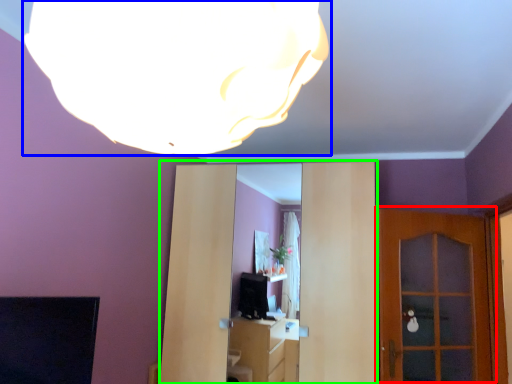
Question: Estimate the real-world distances between objects in this image. Which object is closer to door (highlighted by a red box), lamp (highlighted by a blue box) or entertainment center (highlighted by a green box)?

Choices:
 (A) lamp
 (B) entertainment center

Answer: (B)